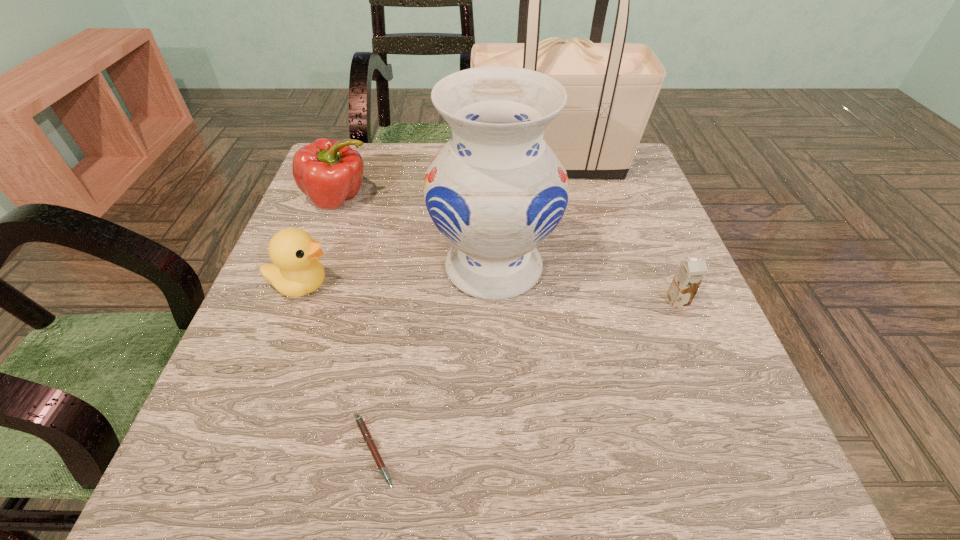
You are a GUI agent. You are given a task and a screenshot of the screen. Output one action in this format:
    pyautogui.click(x=<x>, y=<y>)
    Task: Click on the unoccupied area between the chocolate milk and the vase
    The width and height of the screenshot is (960, 540).
    Given the screenshot: What is the action you would take?
    pyautogui.click(x=586, y=284)

The width and height of the screenshot is (960, 540). I want to click on vacant area that lies between the pepper and the shortest object, so click(356, 325).

The width and height of the screenshot is (960, 540). What are the coordinates of `vacant area between the pen and the duck` in the screenshot? It's located at (338, 368).

You are a GUI agent. You are given a task and a screenshot of the screen. Output one action in this format:
    pyautogui.click(x=<x>, y=<y>)
    Task: Click on the blank region between the fifth shortest object and the pen
    
    Given the screenshot: What is the action you would take?
    pyautogui.click(x=434, y=359)

Where is `vacant space that's between the third shortest object and the second tallest object`? vacant space that's between the third shortest object and the second tallest object is located at coordinates (397, 276).

You are a GUI agent. You are given a task and a screenshot of the screen. Output one action in this format:
    pyautogui.click(x=<x>, y=<y>)
    Task: Click on the vacant space in between the duck and the pepper
    Image resolution: width=960 pixels, height=540 pixels.
    Given the screenshot: What is the action you would take?
    pyautogui.click(x=320, y=242)

Point out which object is positioned as the fourth nearest to the chocolate milk. Please provide its 2D coordinates. Your answer should be formatted as a tuple, i.e. [(x, y)], where the tuple contains the x and y coordinates of a point satisfying the conditions above.

[(295, 271)]

Select which object appears as the third closest to the pepper. Please provide its 2D coordinates. Your answer should be formatted as a tuple, i.e. [(x, y)], where the tuple contains the x and y coordinates of a point satisfying the conditions above.

[(611, 88)]

Locate an element on the screen. This screenshot has width=960, height=540. vacant area in the image that satisfies the following two spatial constraints: 1. on the back side of the fifth tallest object; 2. with handles facing forward on the tallest object is located at coordinates (621, 164).

At what (x,y) coordinates should I click in order to perform the action: click on vacant region that satisfies the following two spatial constraints: 1. on the front side of the vase; 2. on the right side of the chocolate milk. Please return your answer as a coordinate pair (x, y). The width and height of the screenshot is (960, 540). Looking at the image, I should click on (494, 301).